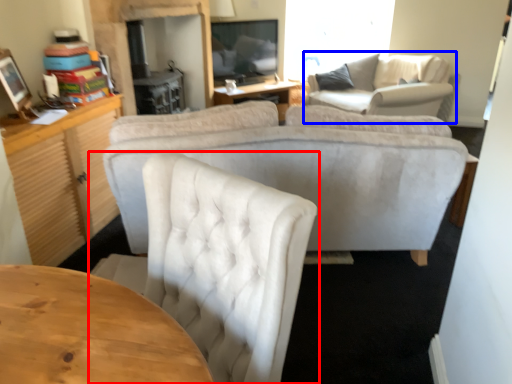
Question: Which point is closer to the camera, chair (highlighted by a red box) or couch (highlighted by a blue box)?

Choices:
 (A) chair
 (B) couch

Answer: (A)